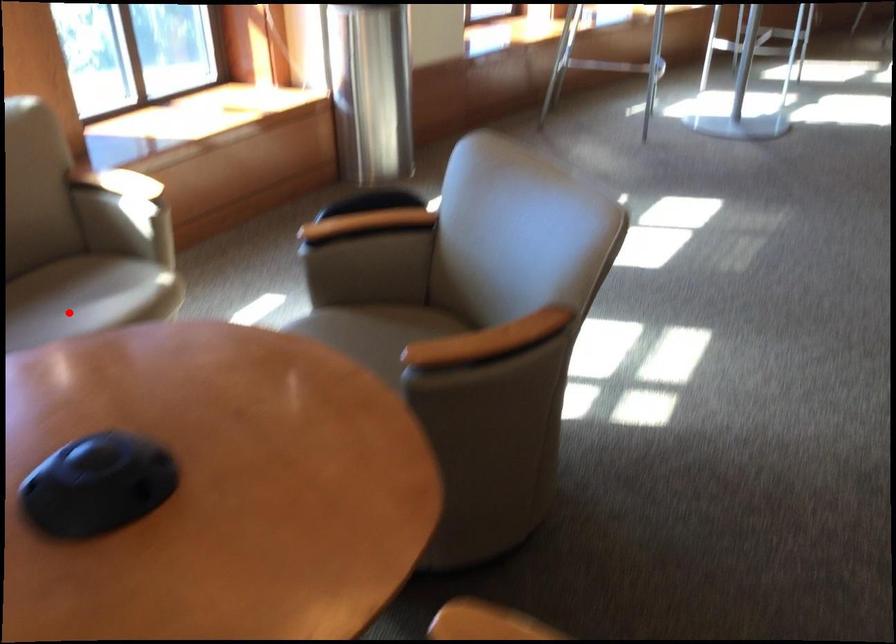
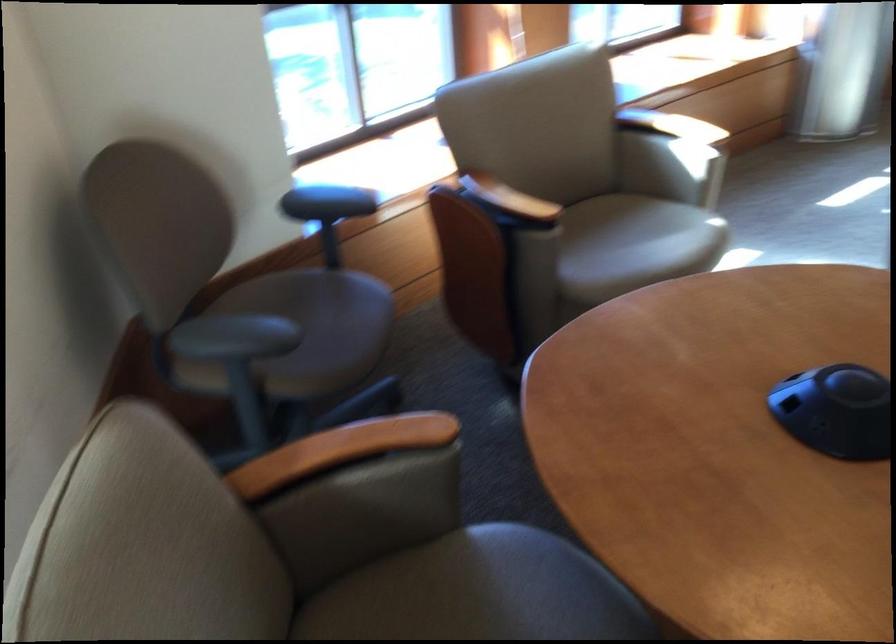
Find the pixel in the second image that matches the highlighted location in the first image.

(633, 245)